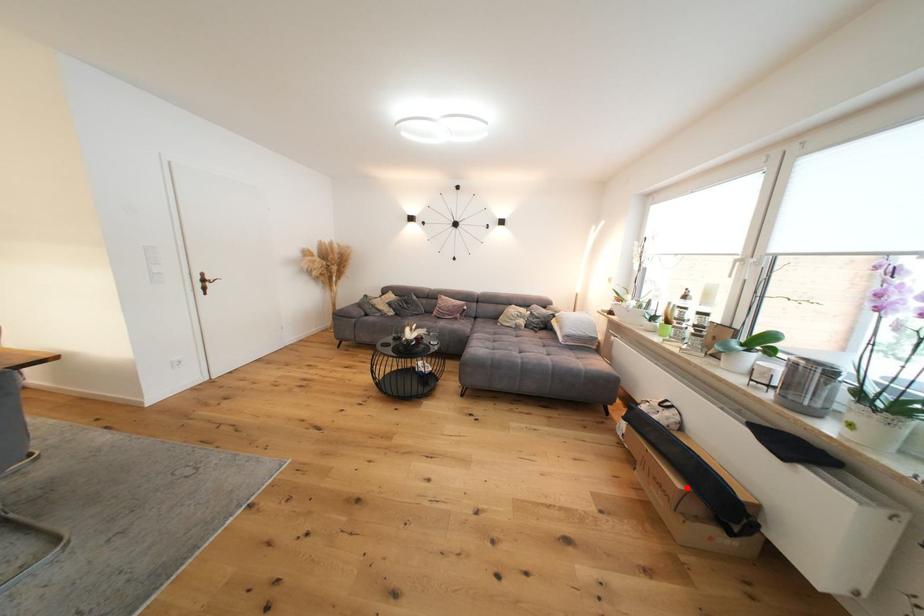
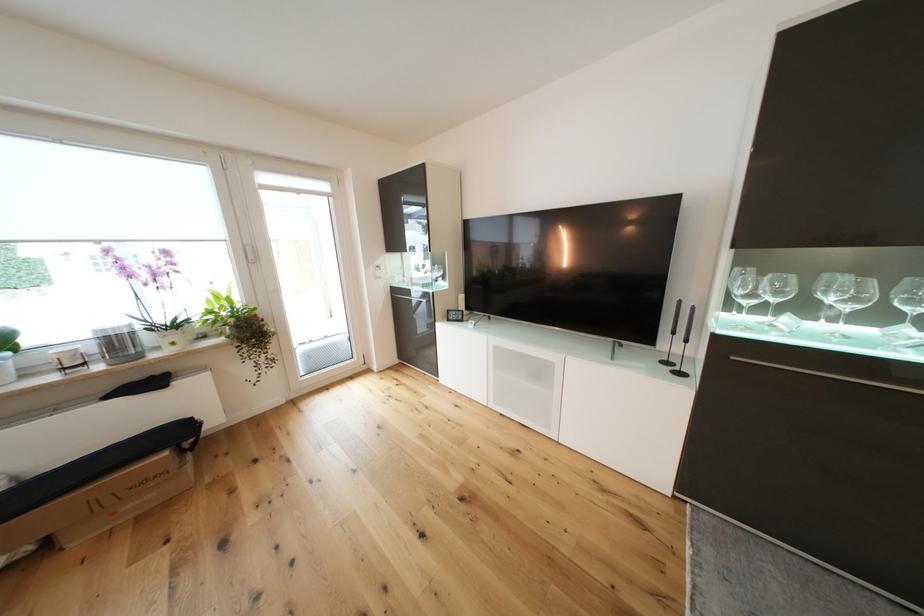
Locate, in the second image, the point that corresponds to the highlighted location in the first image.

(172, 455)